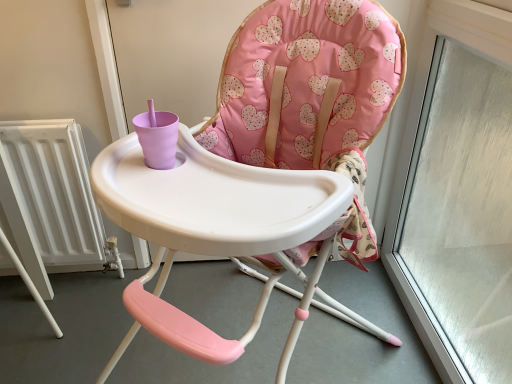
Question: Is pink fabric highchair at center inside the boundaries of white metallic radiator at left, or outside?

Choices:
 (A) outside
 (B) inside

Answer: (A)

Question: From the image's perspective, is pink fabric highchair at center positioned above or below white metallic radiator at left?

Choices:
 (A) above
 (B) below

Answer: (B)

Question: Looking at their shapes, would you say pink fabric highchair at center is wider or thinner than white metallic radiator at left?

Choices:
 (A) thin
 (B) wide

Answer: (B)

Question: Relative to pink fabric highchair at center, is white metallic radiator at left in front or behind?

Choices:
 (A) behind
 (B) front

Answer: (A)

Question: Looking at their shapes, would you say white metallic radiator at left is wider or thinner than pink fabric highchair at center?

Choices:
 (A) thin
 (B) wide

Answer: (A)

Question: From a real-world perspective, relative to pink fabric highchair at center, is white metallic radiator at left vertically above or below?

Choices:
 (A) below
 (B) above

Answer: (A)

Question: Is point (56, 206) positioned closer to the camera than point (365, 231)?

Choices:
 (A) closer
 (B) farther

Answer: (B)